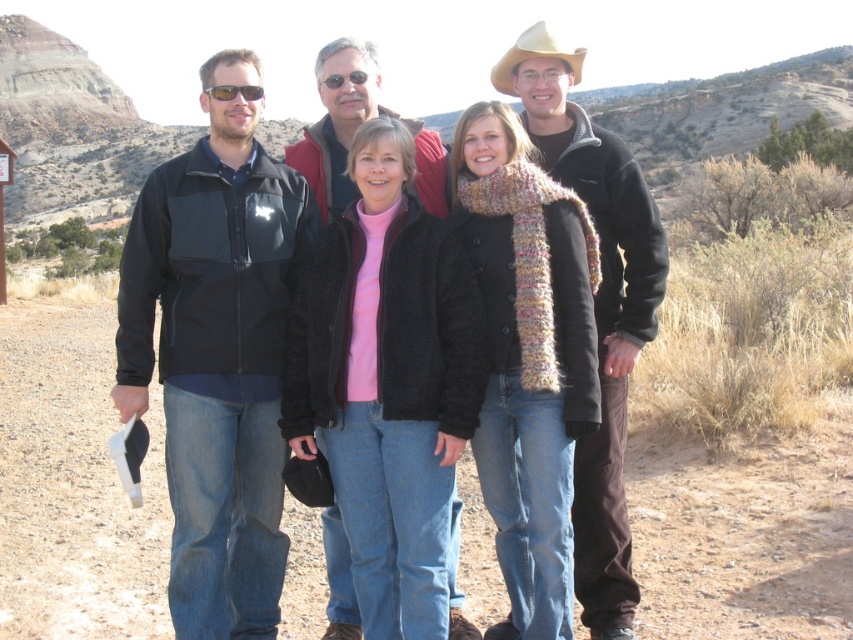
Is matte black jacket at left taller than knitted wool scarf at center?

No, matte black jacket at left is not taller than knitted wool scarf at center.

Does matte black jacket at left come behind knitted wool scarf at center?

That is False.

Between point (225, 323) and point (616, 472), which one is positioned in front?

Point (225, 323) is more forward.

You are a GUI agent. You are given a task and a screenshot of the screen. Output one action in this format:
    pyautogui.click(x=<x>, y=<y>)
    Task: Click on the matte black jacket at left
    
    Given the screenshot: What is the action you would take?
    pyautogui.click(x=218, y=362)

Between knitted wool scarf at center and silver reflective sunglasses at upper left, which one is positioned lower?

Positioned lower is knitted wool scarf at center.

Does knitted wool scarf at center appear over silver reflective sunglasses at upper left?

No.

Find the location of a particular element. knitted wool scarf at center is located at coordinates (596, 307).

From the picture: Is dirt track at center closer to the viewer compared to silver reflective sunglasses at upper left?

Yes, dirt track at center is closer to the viewer.

The width and height of the screenshot is (853, 640). Identify the location of dirt track at center. (73, 486).